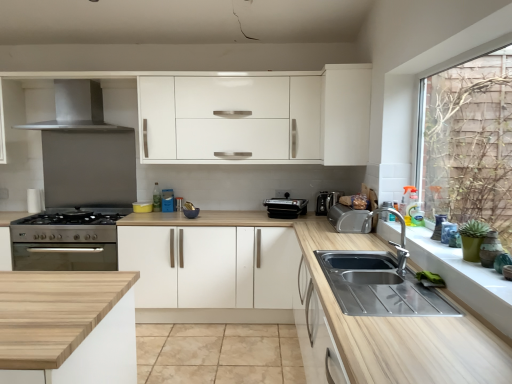
Question: From the image's perspective, is stainless steel cooker at left, which is the second appliance from back to front, under black plastic toaster at center, which is the second appliance in left-to-right order?

Choices:
 (A) no
 (B) yes

Answer: (B)

Question: Is stainless steel cooker at left, marked as the 3th appliance in a front-to-back arrangement, turned away from black plastic toaster at center, which is the second appliance in left-to-right order?

Choices:
 (A) yes
 (B) no

Answer: (B)

Question: Is stainless steel cooker at left, the 4th appliance viewed from the right, far away from black plastic toaster at center, which is the second appliance in left-to-right order?

Choices:
 (A) yes
 (B) no

Answer: (A)

Question: Can you confirm if stainless steel cooker at left, marked as the 3th appliance in a front-to-back arrangement, is bigger than black plastic toaster at center, which appears as the third appliance when viewed from the right?

Choices:
 (A) yes
 (B) no

Answer: (A)

Question: Is stainless steel cooker at left, marked as the 3th appliance in a front-to-back arrangement, in front of black plastic toaster at center, which appears as the third appliance when viewed from the right?

Choices:
 (A) yes
 (B) no

Answer: (A)

Question: From the image's perspective, is wooden at center positioned above or below stainless steel cooker at left, marked as the 3th appliance in a front-to-back arrangement?

Choices:
 (A) below
 (B) above

Answer: (A)

Question: Is wooden at center to the left or to the right of stainless steel cooker at left, the 4th appliance viewed from the right, in the image?

Choices:
 (A) right
 (B) left

Answer: (A)

Question: Considering the positions of wooden at center and stainless steel cooker at left, marked as the first appliance in a left-to-right arrangement, in the image, is wooden at center taller or shorter than stainless steel cooker at left, marked as the first appliance in a left-to-right arrangement,?

Choices:
 (A) tall
 (B) short

Answer: (A)

Question: Is wooden at center in front of or behind stainless steel cooker at left, marked as the 3th appliance in a front-to-back arrangement, in the image?

Choices:
 (A) front
 (B) behind

Answer: (A)

Question: From a real-world perspective, is satin silver coffee machine at center physically located above or below wooden at center?

Choices:
 (A) above
 (B) below

Answer: (A)

Question: Considering their positions, is satin silver coffee machine at center located in front of or behind wooden at center?

Choices:
 (A) front
 (B) behind

Answer: (B)

Question: Is satin silver coffee machine at center inside or outside of wooden at center?

Choices:
 (A) inside
 (B) outside

Answer: (B)

Question: In terms of size, does satin silver coffee machine at center appear bigger or smaller than wooden at center?

Choices:
 (A) big
 (B) small

Answer: (B)

Question: Is silver metallic tap at sink right inside or outside of white matte cabinet at center, which is counted as the 1th cabinetry, starting from the left?

Choices:
 (A) outside
 (B) inside

Answer: (A)

Question: Relative to white matte cabinet at center, which is counted as the 1th cabinetry, starting from the left, is silver metallic tap at sink right in front or behind?

Choices:
 (A) front
 (B) behind

Answer: (A)